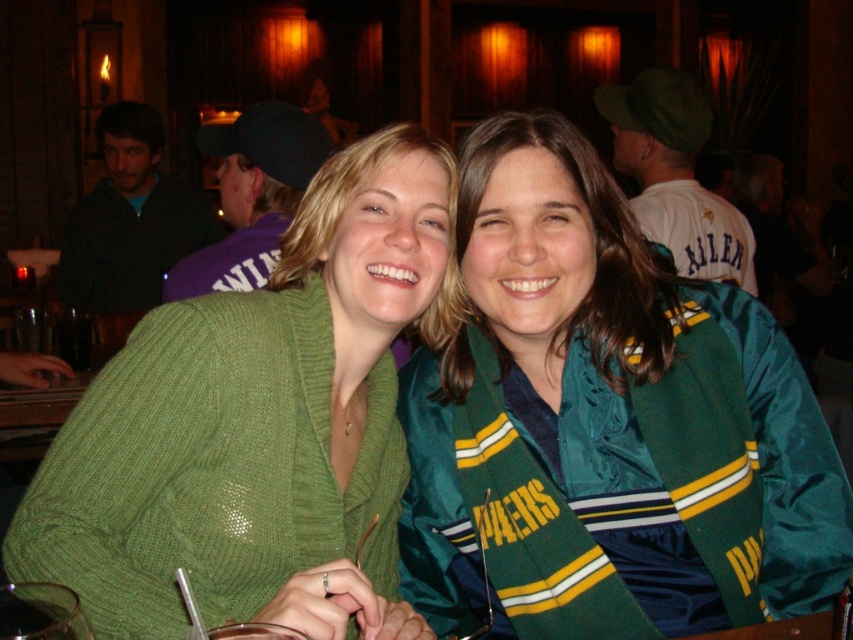
Can you confirm if green satin jacket at center is smaller than green knitted sweater at center?

Yes.

Does green satin jacket at center appear on the left side of green knitted sweater at center?

In fact, green satin jacket at center is to the right of green knitted sweater at center.

This screenshot has width=853, height=640. Find the location of `green satin jacket at center`. green satin jacket at center is located at coordinates (599, 420).

Where is `green satin jacket at center`? green satin jacket at center is located at coordinates (599, 420).